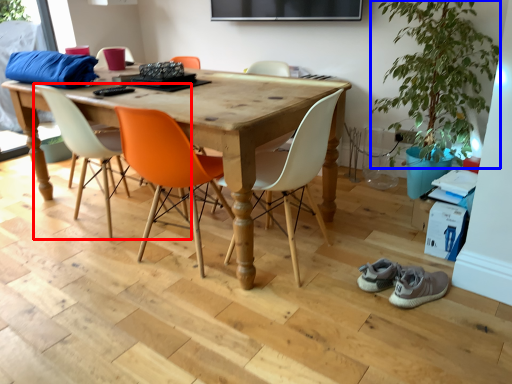
Question: Which of the following is the farthest to the observer, chair (highlighted by a red box) or plant (highlighted by a blue box)?

Choices:
 (A) chair
 (B) plant

Answer: (A)